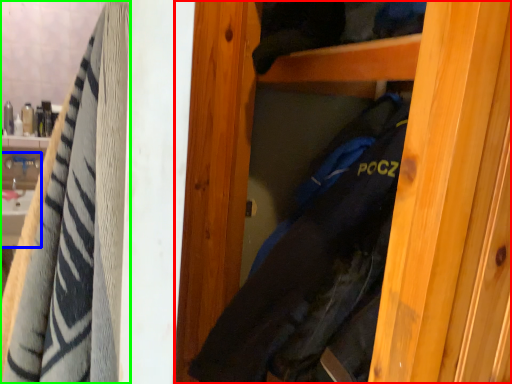
Question: Based on their relative distances, which object is farther from door (highlighted by a red box)? Choose from sink (highlighted by a blue box) and towel (highlighted by a green box).

Choices:
 (A) sink
 (B) towel

Answer: (A)